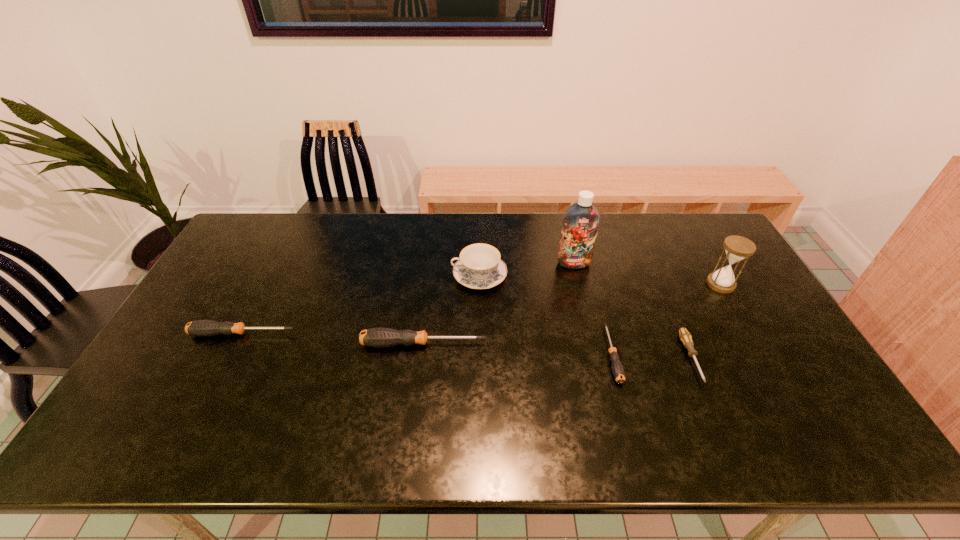
Find the location of a particular element. This screenshot has height=540, width=960. vacant space located on the left of the second screwdriver from left to right is located at coordinates (235, 344).

In order to click on vacant space situated 0.240m on the left of the third screwdriver from left to right in this screenshot , I will do `click(518, 355)`.

Locate an element on the screen. The width and height of the screenshot is (960, 540). vacant space situated 0.330m on the front of the sixth shortest object is located at coordinates (779, 384).

Find the location of `blank space located on the front label of the shampoo`. blank space located on the front label of the shampoo is located at coordinates (590, 333).

Find the location of `free spot located with the handle on the side of the chinaware`. free spot located with the handle on the side of the chinaware is located at coordinates (331, 276).

This screenshot has width=960, height=540. In order to click on blank space located 0.340m with the handle on the side of the chinaware in this screenshot , I will do `click(347, 276)`.

This screenshot has height=540, width=960. In order to click on free region located with the handle on the side of the chinaware in this screenshot , I will do `click(405, 276)`.

Where is `vacant space located at the tip of the rightmost screwdriver`? The width and height of the screenshot is (960, 540). vacant space located at the tip of the rightmost screwdriver is located at coordinates 714,411.

Where is `object at the left edge`? This screenshot has width=960, height=540. object at the left edge is located at coordinates (203, 328).

This screenshot has width=960, height=540. I want to click on object located at the right edge, so click(x=737, y=248).